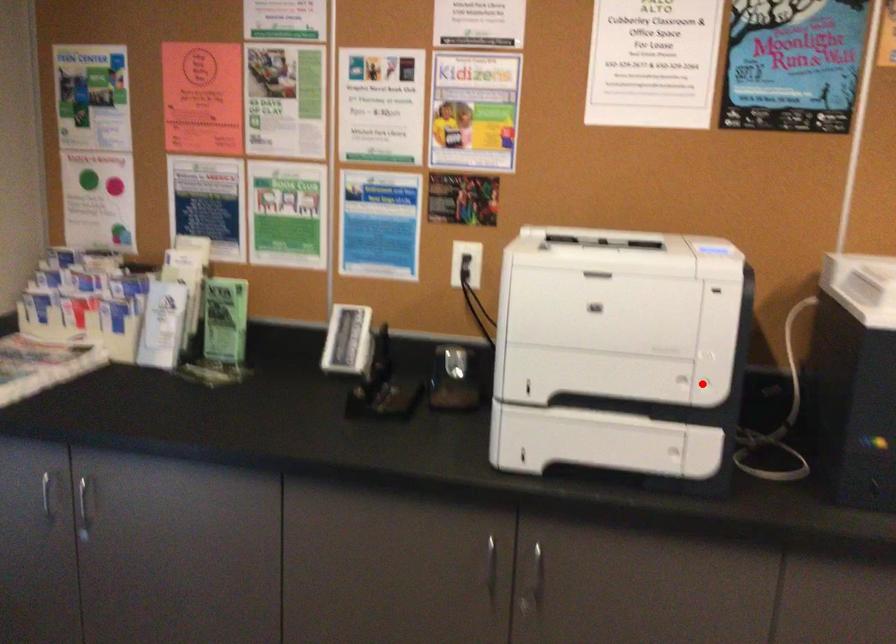
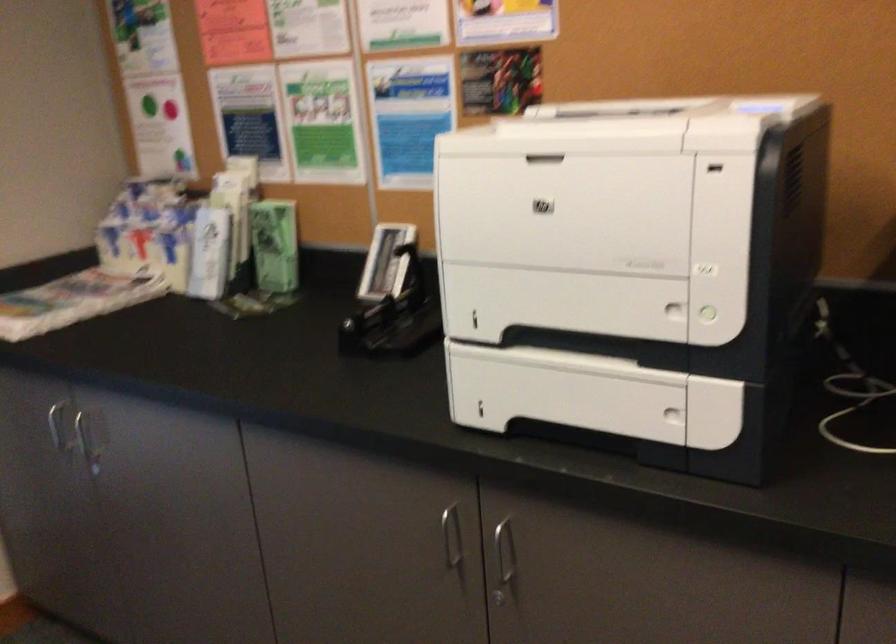
Question: I am providing you with two images of the same scene from different viewpoints. In image1, a red point is highlighted. Considering the same 3D point in image2, which of the following is correct?

Choices:
 (A) It is closer
 (B) It is farther

Answer: (A)